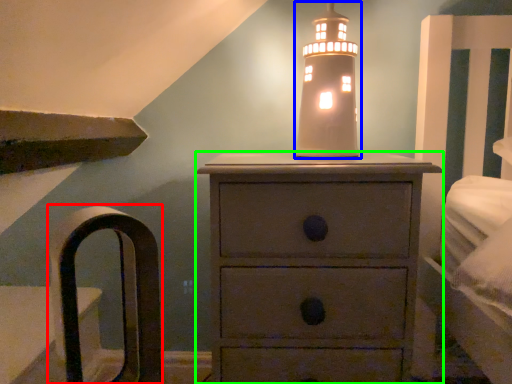
Question: Which is farther away from armchair (highlighted by a red box)? candle holder (highlighted by a blue box) or chest of drawers (highlighted by a green box)?

Choices:
 (A) candle holder
 (B) chest of drawers

Answer: (A)